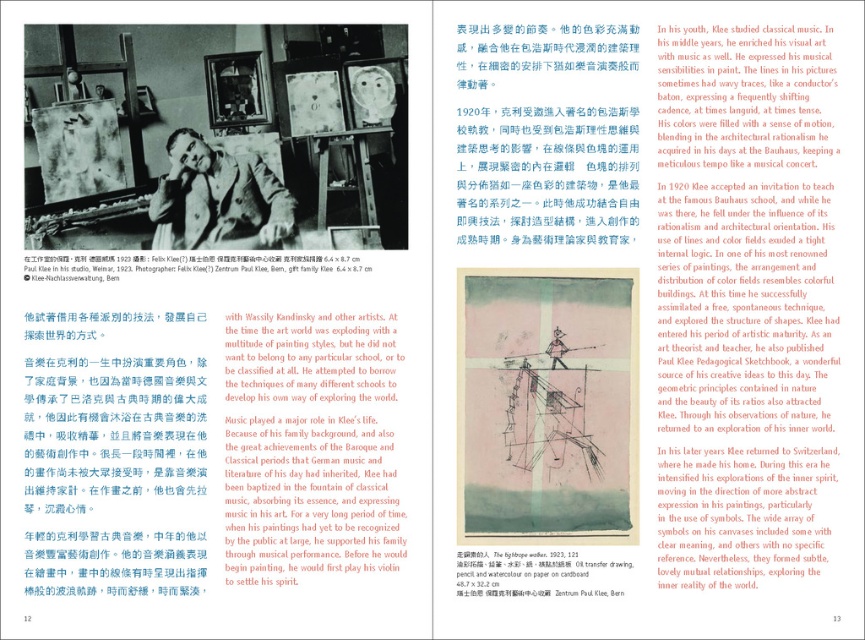
You are a curator planning to install a new exhibit. You have a label that is 0.25 meters wide. The label must be placed to the right of the oil transfer drawing at upper center without overlapping it. The exhibit space uses a coordinate system where the bottom left corner is the origin. Can the label fit without overlapping?

The oil transfer drawing at upper center is located at point [207,148]. Since the label needs to be placed to the right of it and is 0.25 meters wide, the label can fit as long as there is sufficient space to the right. However, without knowing the total width of the exhibit space, it is impossible to confirm if the label will fit without overlapping. The answer requires additional information about the exhibit space dimensions.